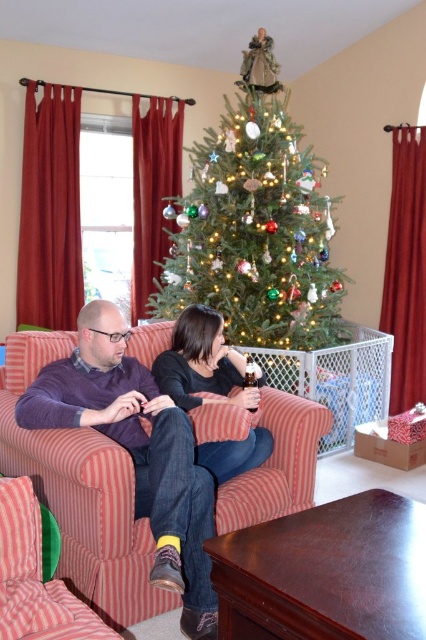
Question: Which point appears closest to the camera in this image?

Choices:
 (A) (63, 616)
 (B) (267, 256)

Answer: (A)

Question: Does striped fabric couch at center have a lesser width compared to pink striped couch at lower left?

Choices:
 (A) no
 (B) yes

Answer: (A)

Question: Can you confirm if striped fabric couch at center is positioned to the left of pink striped couch at lower left?

Choices:
 (A) yes
 (B) no

Answer: (A)

Question: Can you confirm if striped fabric couch at center is positioned to the right of pink striped couch at lower left?

Choices:
 (A) no
 (B) yes

Answer: (A)

Question: Which of these objects is positioned farthest from the green matte christmas tree at center?

Choices:
 (A) pink striped couch at lower left
 (B) striped fabric couch at center
 (C) black matte shirt at center

Answer: (A)

Question: Among these points, which one is farthest from the camera?

Choices:
 (A) (230, 134)
 (B) (55, 340)

Answer: (A)